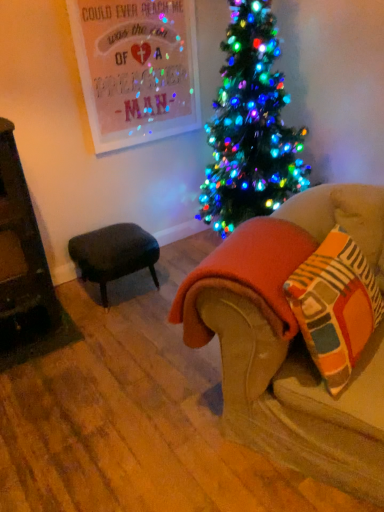
Question: From the image's perspective, is velvet beige couch at lower right under orange fleece blanket at lower right?

Choices:
 (A) yes
 (B) no

Answer: (A)

Question: Can you confirm if velvet beige couch at lower right is wider than orange fleece blanket at lower right?

Choices:
 (A) yes
 (B) no

Answer: (A)

Question: Can you confirm if velvet beige couch at lower right is bigger than orange fleece blanket at lower right?

Choices:
 (A) no
 (B) yes

Answer: (B)

Question: Does velvet beige couch at lower right have a lesser width compared to orange fleece blanket at lower right?

Choices:
 (A) no
 (B) yes

Answer: (A)

Question: Considering the relative positions of velvet beige couch at lower right and orange fleece blanket at lower right in the image provided, is velvet beige couch at lower right behind orange fleece blanket at lower right?

Choices:
 (A) no
 (B) yes

Answer: (A)

Question: Is dark gray fabric stool at lower left bigger or smaller than velvet beige couch at lower right?

Choices:
 (A) big
 (B) small

Answer: (B)

Question: In terms of height, does dark gray fabric stool at lower left look taller or shorter compared to velvet beige couch at lower right?

Choices:
 (A) short
 (B) tall

Answer: (B)

Question: Choose the correct answer: Is dark gray fabric stool at lower left inside velvet beige couch at lower right or outside it?

Choices:
 (A) outside
 (B) inside

Answer: (A)

Question: From the image's perspective, is dark gray fabric stool at lower left above or below velvet beige couch at lower right?

Choices:
 (A) below
 (B) above

Answer: (B)

Question: In terms of width, does dark gray fabric stool at lower left look wider or thinner when compared to orange fleece blanket at lower right?

Choices:
 (A) thin
 (B) wide

Answer: (B)

Question: Is dark gray fabric stool at lower left situated inside orange fleece blanket at lower right or outside?

Choices:
 (A) outside
 (B) inside

Answer: (A)

Question: From a real-world perspective, is dark gray fabric stool at lower left physically located above or below orange fleece blanket at lower right?

Choices:
 (A) below
 (B) above

Answer: (A)

Question: Is dark gray fabric stool at lower left taller or shorter than orange fleece blanket at lower right?

Choices:
 (A) tall
 (B) short

Answer: (B)

Question: From the image's perspective, is orange fleece blanket at lower right located above or below striped cotton throw pillow at lower right?

Choices:
 (A) above
 (B) below

Answer: (A)

Question: Is orange fleece blanket at lower right spatially inside striped cotton throw pillow at lower right, or outside of it?

Choices:
 (A) outside
 (B) inside

Answer: (A)